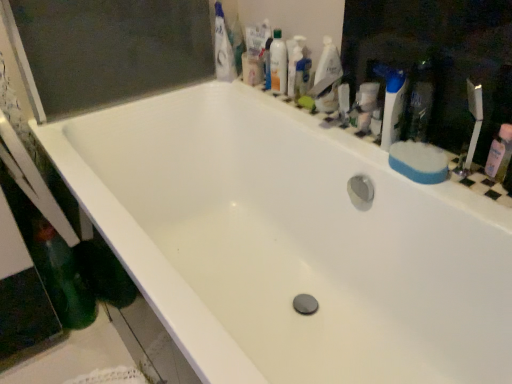
Question: From their relative heights in the image, would you say green matte bottle at lower left is taller or shorter than translucent plastic mouthwash at upper right, positioned as the second mouthwash in bottom-to-top order?

Choices:
 (A) tall
 (B) short

Answer: (A)

Question: Is green matte bottle at lower left situated inside translucent plastic mouthwash at upper right, the 2th mouthwash in the left-to-right sequence, or outside?

Choices:
 (A) inside
 (B) outside

Answer: (B)

Question: Estimate the real-world distances between objects in this image. Which object is closer to the green matte bottle at lower left?

Choices:
 (A) translucent plastic mouthwash at upper right, which is the 2th mouthwash from top to bottom
 (B) translucent plastic mouthwash at upper right, positioned as the first mouthwash in top-to-bottom order
 (C) blue plastic toothbrush at upper right
 (D) blue sponge at right
 (E) white glossy toothpaste at upper center

Answer: (E)

Question: Which of these objects is positioned closest to the blue sponge at right?

Choices:
 (A) pink plastic mouthwash at right, the first mouthwash positioned from the right
 (B) green matte bottle at lower left
 (C) white glossy bottle at upper right
 (D) translucent plastic mouthwash at upper right, marked as the third mouthwash in a right-to-left arrangement
 (E) translucent plastic mouthwash at upper right, positioned as the 2th mouthwash in right-to-left order

Answer: (A)